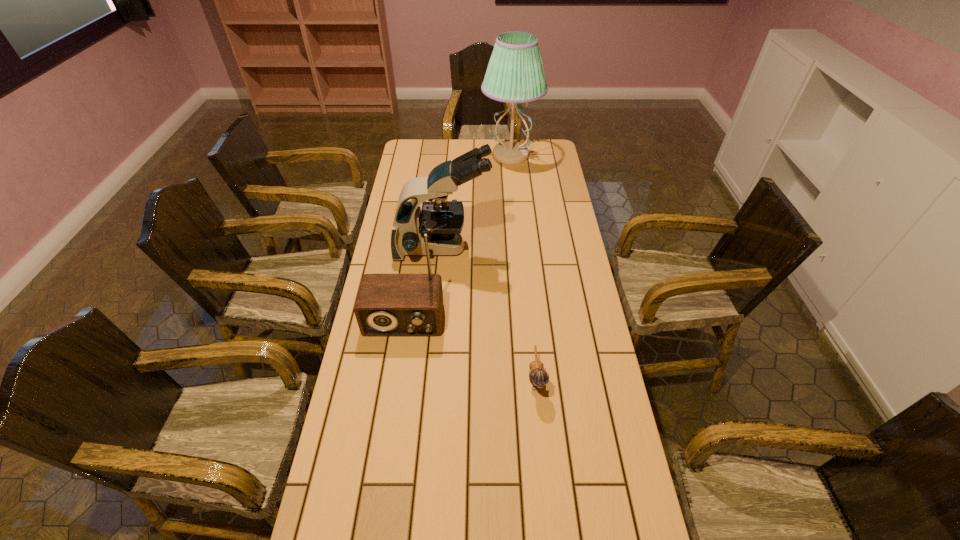
You are a GUI agent. You are given a task and a screenshot of the screen. Output one action in this format:
    pyautogui.click(x=<x>, y=<y>)
    Task: Click on the free spot at the far left corner of the desktop
    This screenshot has height=540, width=960.
    Given the screenshot: What is the action you would take?
    pyautogui.click(x=404, y=165)

This screenshot has height=540, width=960. Find the location of `free region at the far right corner`. free region at the far right corner is located at coordinates (554, 144).

Where is `unoccupied position between the second shortest object and the kitten`? unoccupied position between the second shortest object and the kitten is located at coordinates (469, 349).

Identify the location of free point between the shortest object and the third farthest object. (469, 349).

Locate an element on the screen. This screenshot has height=540, width=960. object identified as the closest to the shortest object is located at coordinates (387, 304).

Identify which object is the closest to the kitten. Please provide its 2D coordinates. Your answer should be formatted as a tuple, i.e. [(x, y)], where the tuple contains the x and y coordinates of a point satisfying the conditions above.

[(387, 304)]

This screenshot has width=960, height=540. Identify the location of free space that satisfies the following two spatial constraints: 1. on the front side of the tallest object; 2. through the eyepieces of the second farthest object. (519, 248).